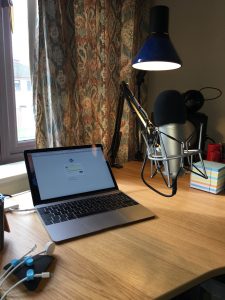
The image size is (225, 300). In order to click on laptop trackpad in this screenshot , I will do `click(98, 224)`.